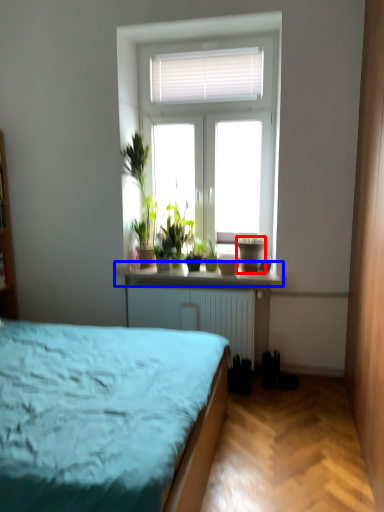
Question: Which object is closer to the camera taking this photo, flowerpot (highlighted by a red box) or window sill (highlighted by a blue box)?

Choices:
 (A) flowerpot
 (B) window sill

Answer: (B)